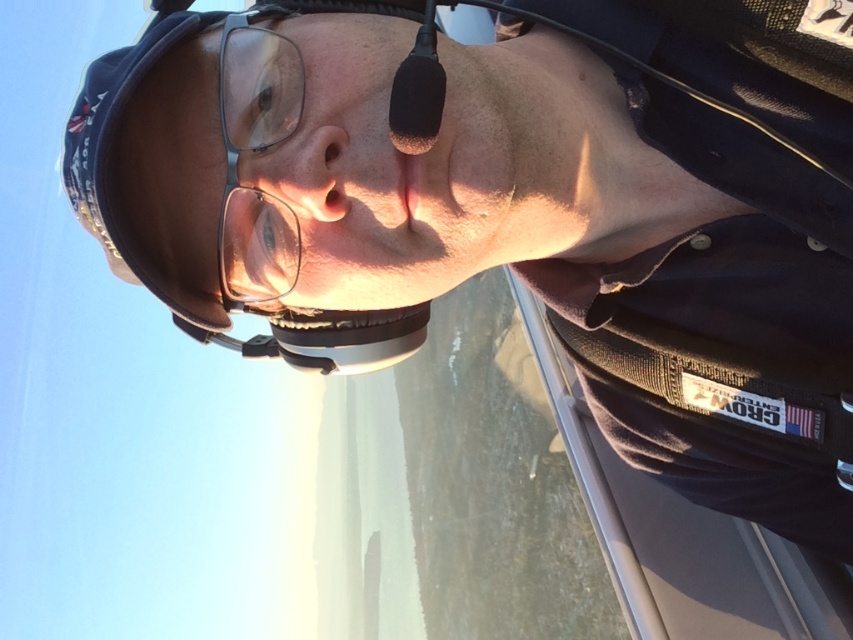
You are a pilot preparing for a flight and need to check your equipment. You have a black fabric helmet at left and clear plastic glasses at center. Which object is positioned lower from your perspective?

The black fabric helmet at left is below clear plastic glasses at center, so the black fabric helmet at left is positioned lower.

You are a pilot preparing for a flight and notice the black fabric helmet at left and the clear plastic glasses at center. Which object is closer to you when you look straight ahead?

The black fabric helmet at left is closer to you because it is in front of the clear plastic glasses at center.